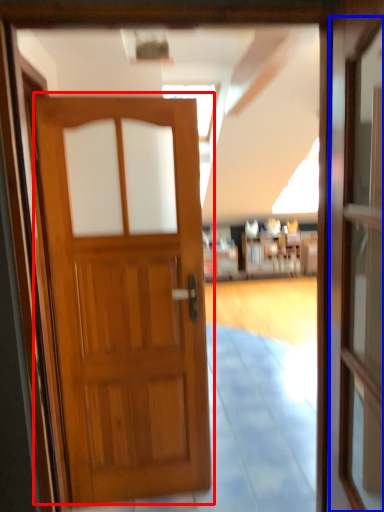
Question: Which object is closer to the camera taking this photo, door (highlighted by a red box) or screen door (highlighted by a blue box)?

Choices:
 (A) door
 (B) screen door

Answer: (B)